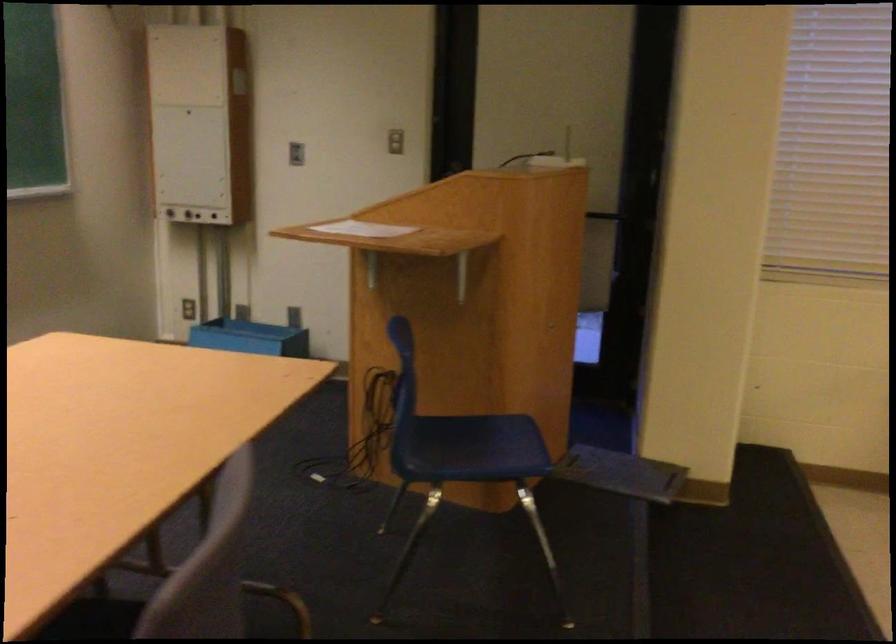
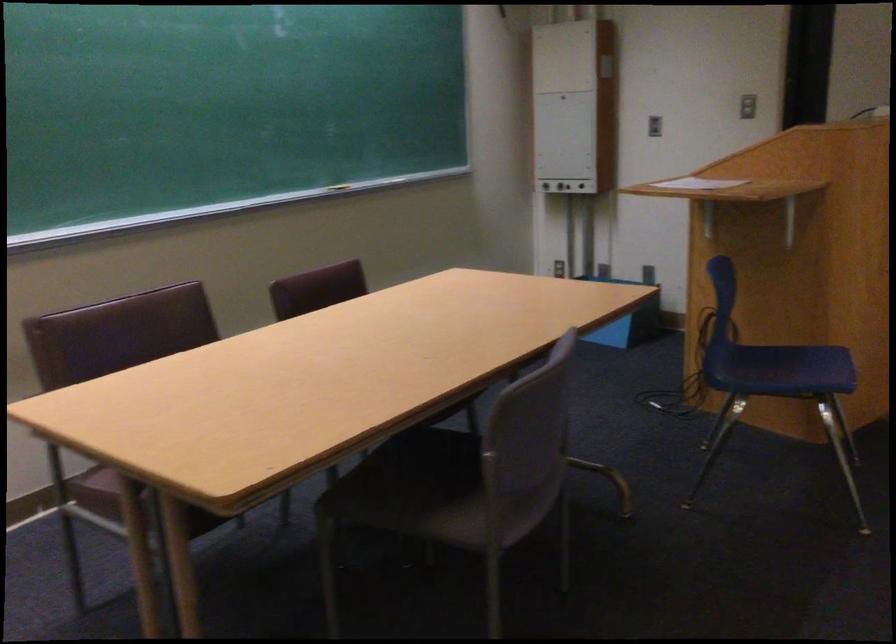
Locate, in the second image, the point that corresponds to point 469,448 in the first image.

(782, 368)